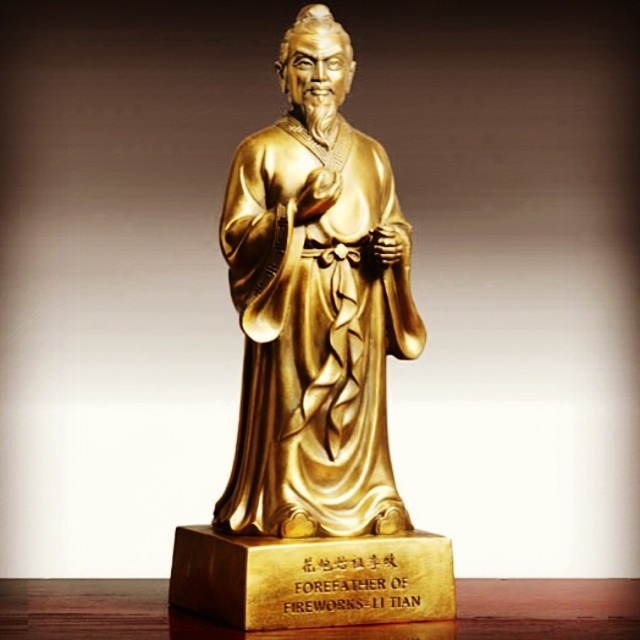
Does gold polished statue at center come behind wooden table at lower center?

Yes, it is.

The height and width of the screenshot is (640, 640). Describe the element at coordinates (316, 307) in the screenshot. I see `gold polished statue at center` at that location.

Is point (392, 182) closer to camera compared to point (77, 604)?

That is False.

Identify the location of gold polished statue at center. [x=316, y=307].